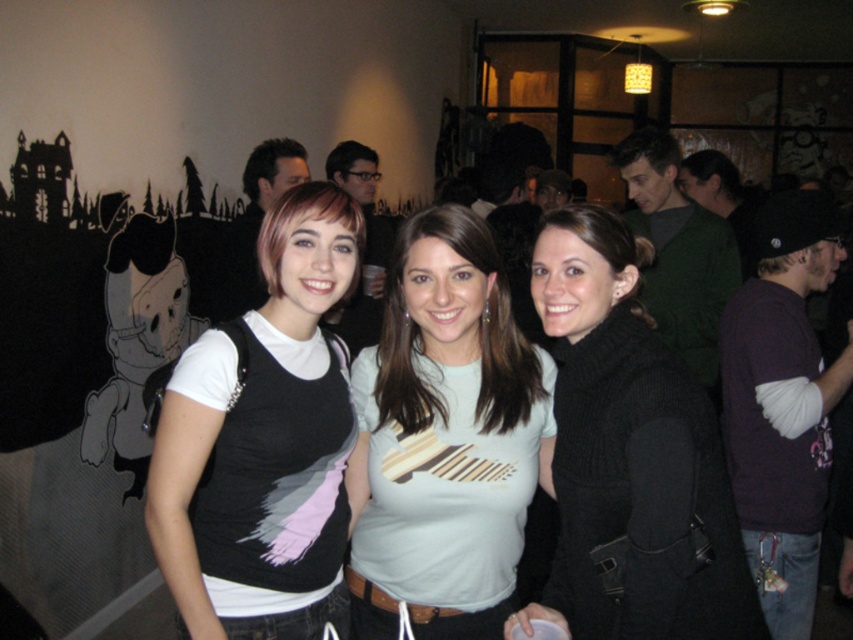
This screenshot has height=640, width=853. I want to click on matte black t-shirt at center, so click(x=263, y=442).

Describe the element at coordinates (263, 442) in the screenshot. I see `matte black t-shirt at center` at that location.

Locate an element on the screen. The height and width of the screenshot is (640, 853). matte black t-shirt at center is located at coordinates coord(263,442).

Consider the image. Does light gray cotton t-shirt at center have a lesser width compared to black wool sweater at center?

Indeed, light gray cotton t-shirt at center has a lesser width compared to black wool sweater at center.

Does point (473, 284) come farther from viewer compared to point (564, 369)?

No, it is not.

You are a GUI agent. You are given a task and a screenshot of the screen. Output one action in this format:
    pyautogui.click(x=<x>, y=<y>)
    Task: Click on the light gray cotton t-shirt at center
    This screenshot has width=853, height=640.
    Given the screenshot: What is the action you would take?
    pyautogui.click(x=445, y=438)

From the picture: Who is more distant from viewer, (x=213, y=509) or (x=450, y=228)?

Point (x=213, y=509)

Which of these two, matte black t-shirt at center or light gray cotton t-shirt at center, stands shorter?

light gray cotton t-shirt at center

At what (x,y) coordinates should I click in order to perform the action: click on matte black t-shirt at center. Please return your answer as a coordinate pair (x, y). The image size is (853, 640). Looking at the image, I should click on (263, 442).